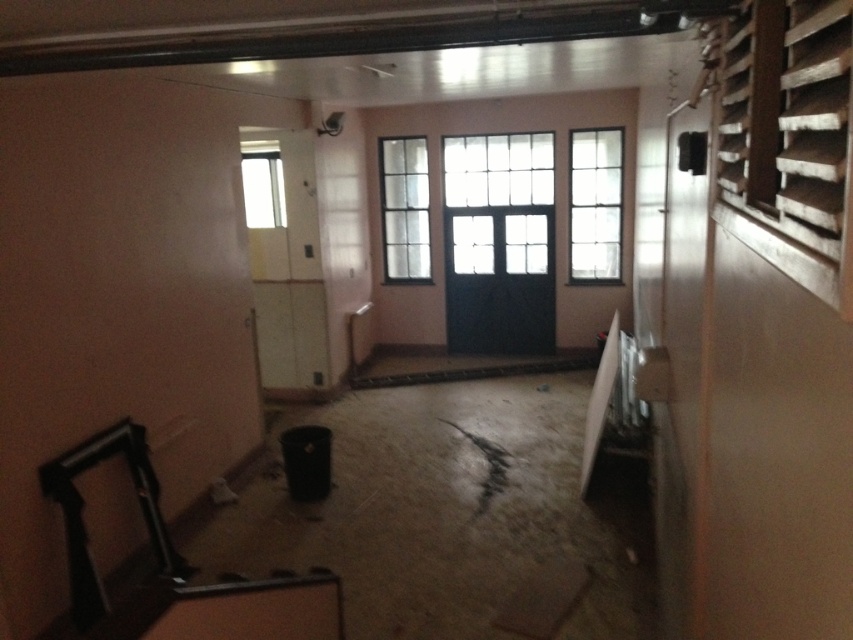
Can you confirm if black matte door at center is positioned below clear glass window at center?

Yes, black matte door at center is below clear glass window at center.

Who is shorter, black matte door at center or clear glass window at center?

With less height is clear glass window at center.

Is point (552, 209) closer to camera compared to point (589, 280)?

Yes, point (552, 209) is closer to viewer.

Find the location of `black matte door at center`. black matte door at center is located at coordinates (498, 280).

Can you confirm if white glossy door at center is positioned to the left of black matte door at center?

Indeed, white glossy door at center is positioned on the left side of black matte door at center.

Can you confirm if white glossy door at center is positioned above black matte door at center?

Yes.

At what (x,y) coordinates should I click in order to perform the action: click on white glossy door at center. Please return your answer as a coordinate pair (x, y). The width and height of the screenshot is (853, 640). Looking at the image, I should click on (286, 262).

Does white glossy door at center have a greater height compared to clear glass window at center?

Yes, white glossy door at center is taller than clear glass window at center.

This screenshot has height=640, width=853. I want to click on white glossy door at center, so click(x=286, y=262).

Locate an element on the screen. The image size is (853, 640). white glossy door at center is located at coordinates (286, 262).